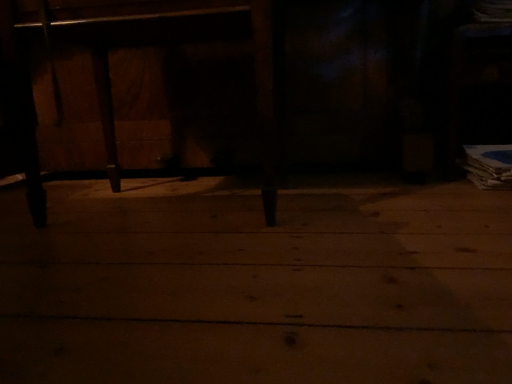
Question: Is wooden table at center inside or outside of wooden floor at center?

Choices:
 (A) inside
 (B) outside

Answer: (B)

Question: From a real-world perspective, relative to wooden floor at center, is wooden table at center vertically above or below?

Choices:
 (A) below
 (B) above

Answer: (B)

Question: Considering the positions of point pyautogui.click(x=420, y=132) and point pyautogui.click(x=458, y=342), is point pyautogui.click(x=420, y=132) closer or farther from the camera than point pyautogui.click(x=458, y=342)?

Choices:
 (A) closer
 (B) farther

Answer: (B)

Question: Is wooden floor at center situated inside wooden table at center or outside?

Choices:
 (A) inside
 (B) outside

Answer: (B)

Question: From the image's perspective, is wooden floor at center located above or below wooden table at center?

Choices:
 (A) below
 (B) above

Answer: (A)

Question: Is wooden floor at center wider or thinner than wooden table at center?

Choices:
 (A) thin
 (B) wide

Answer: (B)

Question: In terms of size, does wooden floor at center appear bigger or smaller than wooden table at center?

Choices:
 (A) big
 (B) small

Answer: (B)